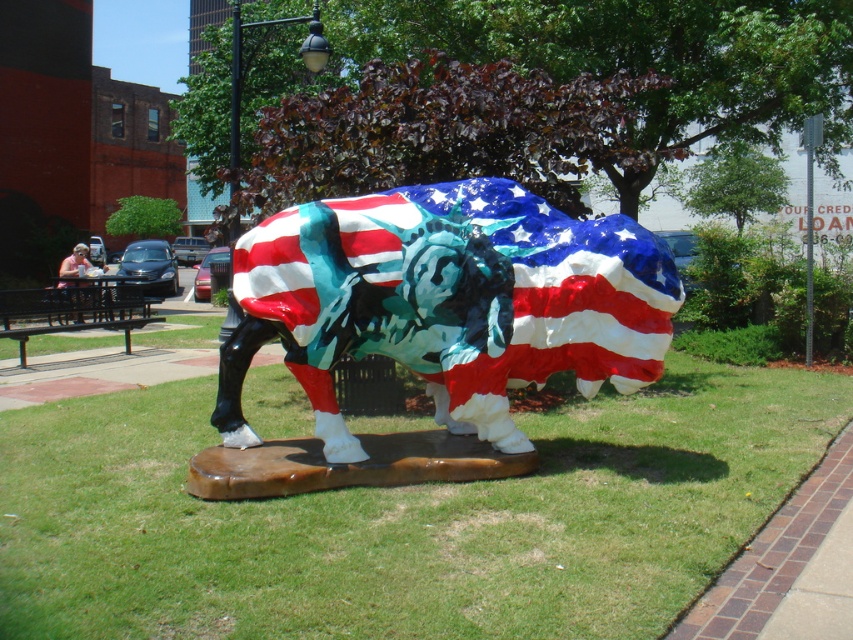
Question: Does green grass at center have a greater width compared to shiny metallic bull at center?

Choices:
 (A) yes
 (B) no

Answer: (A)

Question: Which of the following is the closest to the observer?

Choices:
 (A) (62, 534)
 (B) (582, 388)

Answer: (A)

Question: Which point is closer to the camera?

Choices:
 (A) green grass at center
 (B) shiny metallic bull at center

Answer: (A)

Question: Can you confirm if green grass at center is positioned to the left of shiny metallic bull at center?

Choices:
 (A) no
 (B) yes

Answer: (B)

Question: From the image, what is the correct spatial relationship of green grass at center in relation to shiny metallic bull at center?

Choices:
 (A) right
 (B) left

Answer: (B)